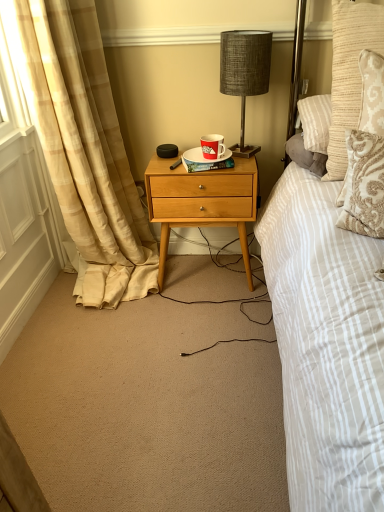
Describe the element at coordinates (212, 146) in the screenshot. I see `red paper cup at center` at that location.

At what (x,y) coordinates should I click in order to perform the action: click on white glossy plate at center. Please return your answer as a coordinate pair (x, y). This screenshot has height=512, width=384. Looking at the image, I should click on (202, 156).

Find the location of a particular element. natural wood nightstand at center is located at coordinates (202, 202).

Describe the element at coordinates (349, 72) in the screenshot. I see `textured beige pillow at upper right` at that location.

Identify the location of red paper cup at center. Image resolution: width=384 pixels, height=512 pixels. (212, 146).

Would you consider hardcover book at center to be distant from natural wood nightstand at center?

hardcover book at center is near natural wood nightstand at center, not far away.

Locate an element on the screen. book above the natural wood nightstand at center (from a real-world perspective) is located at coordinates (207, 165).

Considering the relative sizes of hardcover book at center and natural wood nightstand at center in the image provided, is hardcover book at center smaller than natural wood nightstand at center?

Indeed, hardcover book at center has a smaller size compared to natural wood nightstand at center.

Is natural wood nightstand at center completely or partially inside hardcover book at center?

That's incorrect, natural wood nightstand at center is not inside hardcover book at center.

Which object is wider, natural wood nightstand at center or textured beige pillow at upper right?

natural wood nightstand at center.

Considering the sizes of objects natural wood nightstand at center and textured beige pillow at upper right in the image provided, who is taller, natural wood nightstand at center or textured beige pillow at upper right?

natural wood nightstand at center.

Is natural wood nightstand at center looking in the opposite direction of textured beige pillow at upper right?

natural wood nightstand at center does not have its back to textured beige pillow at upper right.

Is natural wood nightstand at center to the left of textured beige pillow at upper right from the viewer's perspective?

Correct, you'll find natural wood nightstand at center to the left of textured beige pillow at upper right.

Consider the image. Does textured gray lamp at upper center have a greater height compared to red paper cup at center?

Yes, textured gray lamp at upper center is taller than red paper cup at center.

Does textured gray lamp at upper center come behind red paper cup at center?

No, textured gray lamp at upper center is closer to the viewer.

Is textured gray lamp at upper center wider or thinner than red paper cup at center?

textured gray lamp at upper center is wider than red paper cup at center.

Is textured gray lamp at upper center at the left side of red paper cup at center?

No, textured gray lamp at upper center is not to the left of red paper cup at center.

Considering the sizes of objects red paper cup at center and natural wood nightstand at center in the image provided, who is bigger, red paper cup at center or natural wood nightstand at center?

Bigger between the two is natural wood nightstand at center.

Which object is wider, red paper cup at center or natural wood nightstand at center?

natural wood nightstand at center.

Consider the image. Between red paper cup at center and natural wood nightstand at center, which one appears on the right side from the viewer's perspective?

Positioned to the right is red paper cup at center.

The image size is (384, 512). I want to click on desk on the left of red paper cup at center, so click(x=202, y=202).

Can you confirm if red paper cup at center is shorter than textured gray lamp at upper center?

Yes, red paper cup at center is shorter than textured gray lamp at upper center.

Can you confirm if red paper cup at center is bigger than textured gray lamp at upper center?

No.

Find the location of a particular element. Image resolution: width=384 pixels, height=512 pixels. lamp located above the red paper cup at center (from a real-world perspective) is located at coordinates (245, 73).

Based on the photo, which of these two, red paper cup at center or textured gray lamp at upper center, is wider?

Wider between the two is textured gray lamp at upper center.

Is textured beige pillow at upper right in front of hardcover book at center?

Yes, it is.

Considering the sizes of textured beige pillow at upper right and hardcover book at center in the image, is textured beige pillow at upper right bigger or smaller than hardcover book at center?

Considering their sizes, textured beige pillow at upper right takes up more space than hardcover book at center.

Considering the relative sizes of textured beige pillow at upper right and hardcover book at center in the image provided, is textured beige pillow at upper right taller than hardcover book at center?

Indeed, textured beige pillow at upper right has a greater height compared to hardcover book at center.

How much distance is there between textured beige pillow at upper right and hardcover book at center?

A distance of 21.09 inches exists between textured beige pillow at upper right and hardcover book at center.

The width and height of the screenshot is (384, 512). I want to click on curtain that is below the white glossy plate at center (from the image's perspective), so click(83, 146).

Based on the photo, is white glossy plate at center in front of or behind beige plaid curtain at left in the image?

Visually, white glossy plate at center is located behind beige plaid curtain at left.

Is white glossy plate at center smaller than beige plaid curtain at left?

Correct, white glossy plate at center occupies less space than beige plaid curtain at left.

Find the location of a particular element. The height and width of the screenshot is (512, 384). book above the natural wood nightstand at center (from a real-world perspective) is located at coordinates (207, 165).

Locate an element on the screen. This screenshot has height=512, width=384. desk that is on the left side of textured beige pillow at upper right is located at coordinates (202, 202).

Considering their positions, is hardcover book at center positioned further to red paper cup at center than natural wood nightstand at center?

natural wood nightstand at center lies further to red paper cup at center than the other object.

Estimate the real-world distances between objects in this image. Which object is further from natural wood nightstand at center, textured gray lamp at upper center or red paper cup at center?

Based on the image, textured gray lamp at upper center appears to be further to natural wood nightstand at center.

Which object lies nearer to the anchor point white glossy plate at center, red paper cup at center or textured gray lamp at upper center?

red paper cup at center lies closer to white glossy plate at center than the other object.

From the image, which object appears to be nearer to textured gray lamp at upper center, hardcover book at center or natural wood nightstand at center?

The object closer to textured gray lamp at upper center is natural wood nightstand at center.

Considering their positions, is natural wood nightstand at center positioned further to white glossy plate at center than textured beige pillow at upper right?

textured beige pillow at upper right is positioned further to the anchor white glossy plate at center.

From the picture: Based on their spatial positions, is beige plaid curtain at left or hardcover book at center closer to textured beige pillow at upper right?

Based on the image, hardcover book at center appears to be nearer to textured beige pillow at upper right.

Based on their spatial positions, is hardcover book at center or textured beige pillow at upper right further from white glossy plate at center?

textured beige pillow at upper right is positioned further to the anchor white glossy plate at center.

Estimate the real-world distances between objects in this image. Which object is closer to hardcover book at center, textured beige pillow at upper right or red paper cup at center?

Among the two, red paper cup at center is located nearer to hardcover book at center.

I want to click on book between beige plaid curtain at left and red paper cup at center, so click(x=207, y=165).

Identify the location of coffee cup between textured beige pillow at upper right and natural wood nightstand at center in the front-back direction. (212, 146).

Image resolution: width=384 pixels, height=512 pixels. Find the location of `desk between beige plaid curtain at left and textured beige pillow at upper right from left to right`. desk between beige plaid curtain at left and textured beige pillow at upper right from left to right is located at coordinates (202, 202).

Identify the location of coffee cup positioned between textured beige pillow at upper right and hardcover book at center from near to far. This screenshot has width=384, height=512. (212, 146).